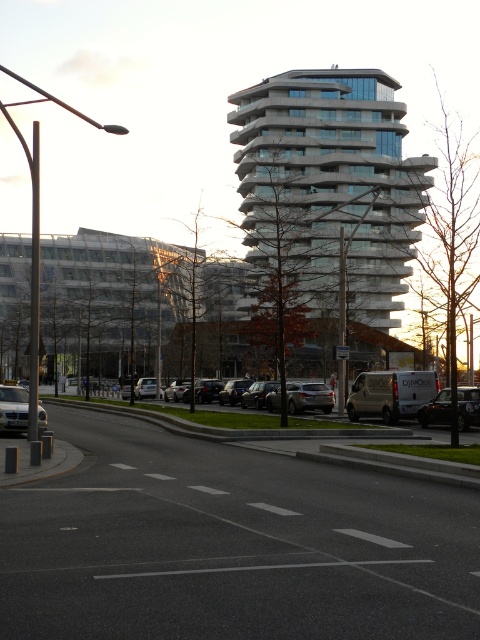
Question: Is shiny black sedan at right to the right of silver metallic car at lower left from the viewer's perspective?

Choices:
 (A) no
 (B) yes

Answer: (B)

Question: Which of the following is the farthest from the observer?

Choices:
 (A) silver metallic van at center
 (B) shiny black sedan at right
 (C) silver metallic car at lower left

Answer: (B)

Question: Which point is closer to the camera?

Choices:
 (A) white glass building at center
 (B) shiny black sedan at right
 (C) silver metallic van at center

Answer: (C)

Question: Can you confirm if silver metallic van at center is bigger than shiny black sedan at right?

Choices:
 (A) no
 (B) yes

Answer: (B)

Question: Which of the following is the closest to the observer?

Choices:
 (A) tap(316, 401)
 (B) tap(20, 428)

Answer: (B)

Question: Where is white glass building at center located in relation to satin silver sedan at center in the image?

Choices:
 (A) left
 (B) right

Answer: (B)